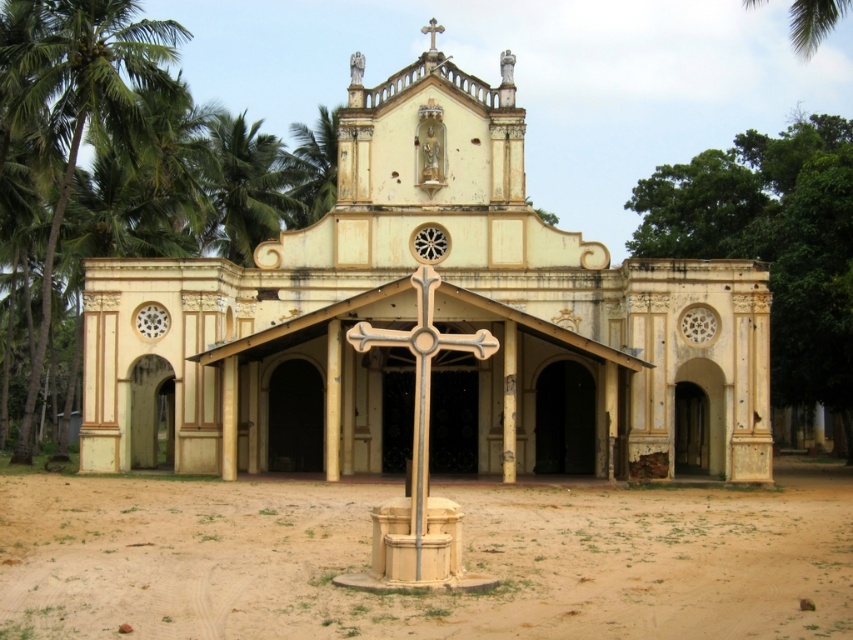
In the scene shown: You are standing in front of the church and notice two objects at the upper center of the scene. Which one is positioned higher up between the green leafy palm tree at upper center and the white stone cross at upper center?

The white stone cross at upper center is positioned higher up than the green leafy palm tree at upper center because the palm tree is below the cross.

Looking at this image, you are standing in front of the church and want to take a photo that includes both the green leafy palm tree at left and the white stone cross at upper center. Which object should you focus on first to ensure both are in sharp focus?

You should focus on the green leafy palm tree at left first because it is closer to the viewer than the white stone cross at upper center, so adjusting focus from near to far will help both objects be in sharp focus.

Consider the image. You are standing at the center of the image and want to walk towards the green leafy palm tree at left. In which direction should you move?

You should move towards the left direction since the green leafy palm tree at left is located at the left side of the image.